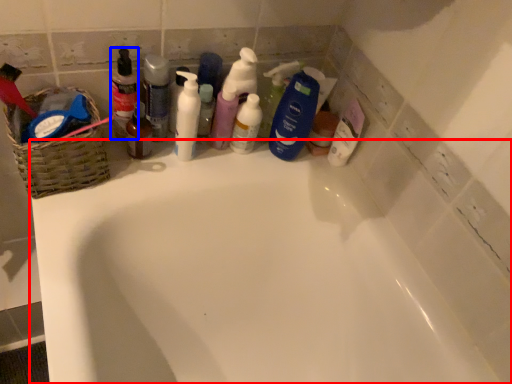
Question: Among these objects, which one is nearest to the camera, bathtub (highlighted by a red box) or toiletry (highlighted by a blue box)?

Choices:
 (A) bathtub
 (B) toiletry

Answer: (A)